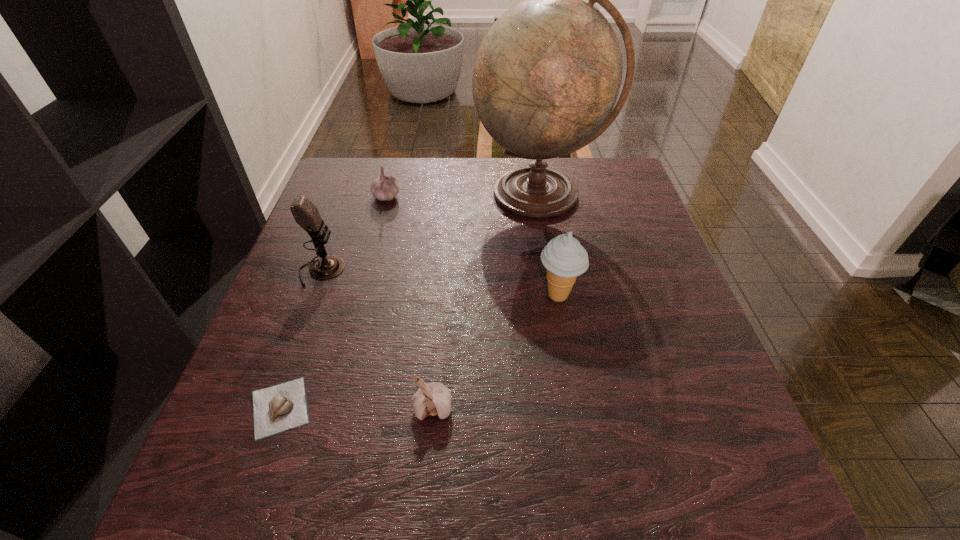
What are the coordinates of `free spot located 0.090m on the back of the third object from right to left` in the screenshot? It's located at (438, 347).

This screenshot has height=540, width=960. I want to click on blank space located on the front of the shortest object, so click(245, 511).

I want to click on globe at the far edge, so click(x=547, y=75).

Where is `garlic that is at the far edge`? garlic that is at the far edge is located at coordinates (384, 188).

Where is `microphone present at the left edge`? This screenshot has width=960, height=540. microphone present at the left edge is located at coordinates click(x=306, y=214).

Identify the location of object situated at the right edge. (547, 75).

Where is `object present at the far left corner`? The image size is (960, 540). object present at the far left corner is located at coordinates (384, 188).

The width and height of the screenshot is (960, 540). I want to click on object that is at the far right corner, so click(x=547, y=75).

Locate an element on the screen. The image size is (960, 540). vacant area at the far edge is located at coordinates (514, 167).

The height and width of the screenshot is (540, 960). I want to click on free space at the left edge of the desktop, so click(x=320, y=335).